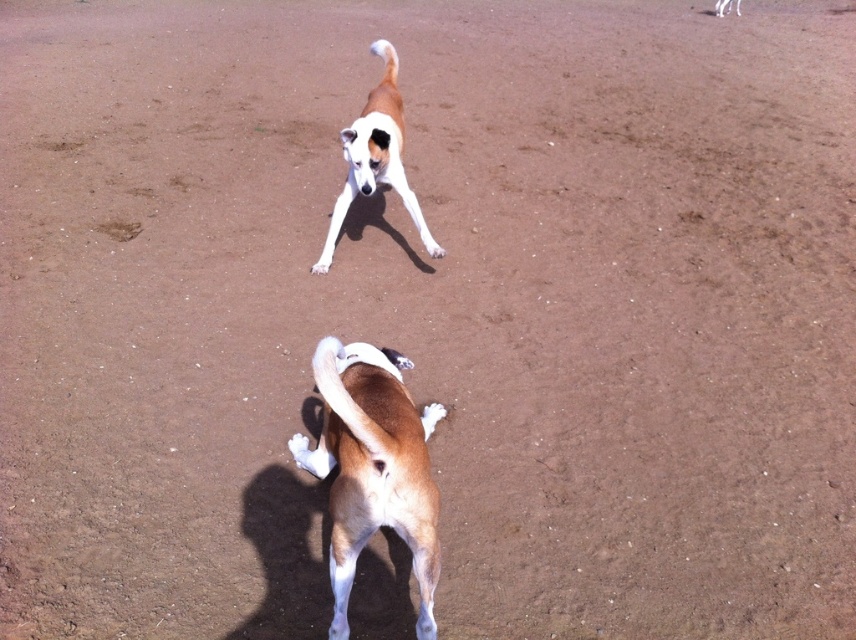
You are a photographer positioned at the origin point. The brown matte dog at center is located at point 0.731, 0.436. Can you determine if the dog is within the camera frame that extends from 0.5 to 1.0 in both x and y coordinates?

The brown matte dog at center is located at point (372, 467). Since the camera frame extends from 0.5 to 1.0 in both x and y coordinates, the dog is within the frame in the x direction but below the minimum y coordinate of 0.5. Therefore, it is partially outside the frame.

Looking at this image, you are a dog trainer who wants to separate the two dogs for training. The minimum safe distance required between them is 2 meters to prevent distraction. Based on the image, can you confirm if the current distance between the brown matte dog at center and the brown and white fur dog at center meets this requirement?

The distance between the brown matte dog at center and the brown and white fur dog at center is 1.78 meters, which is less than the required 2 meters. Therefore, the current distance does not meet the minimum safe distance requirement to prevent distraction.